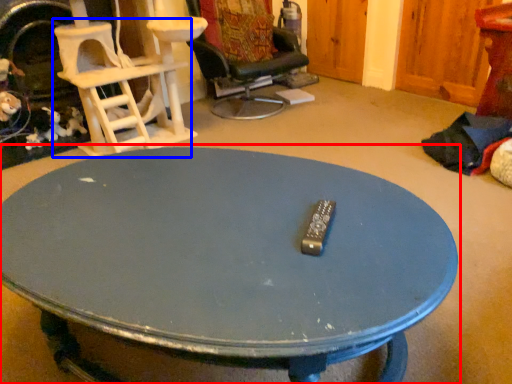
Question: Among these objects, which one is farthest to the camera, coffee table (highlighted by a red box) or chair (highlighted by a blue box)?

Choices:
 (A) coffee table
 (B) chair

Answer: (B)